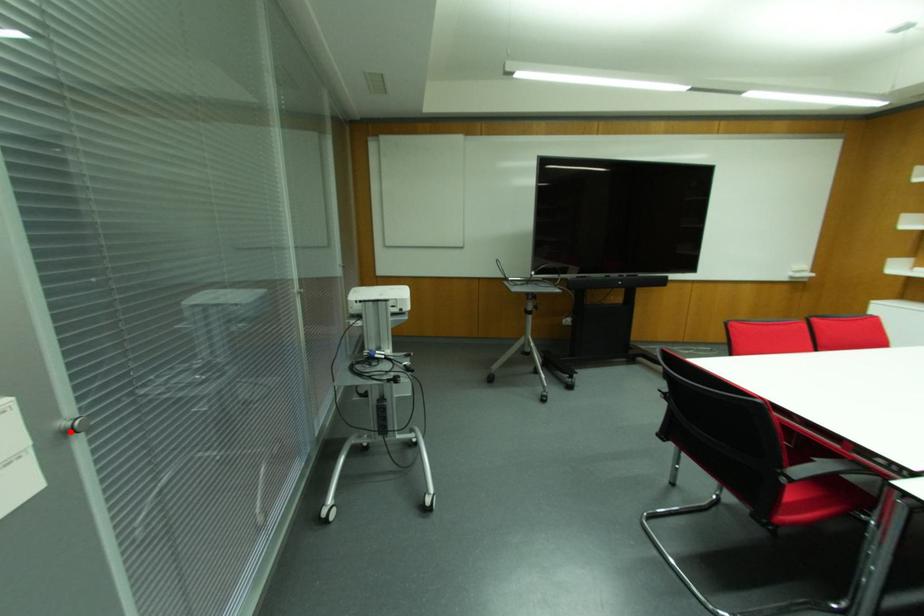
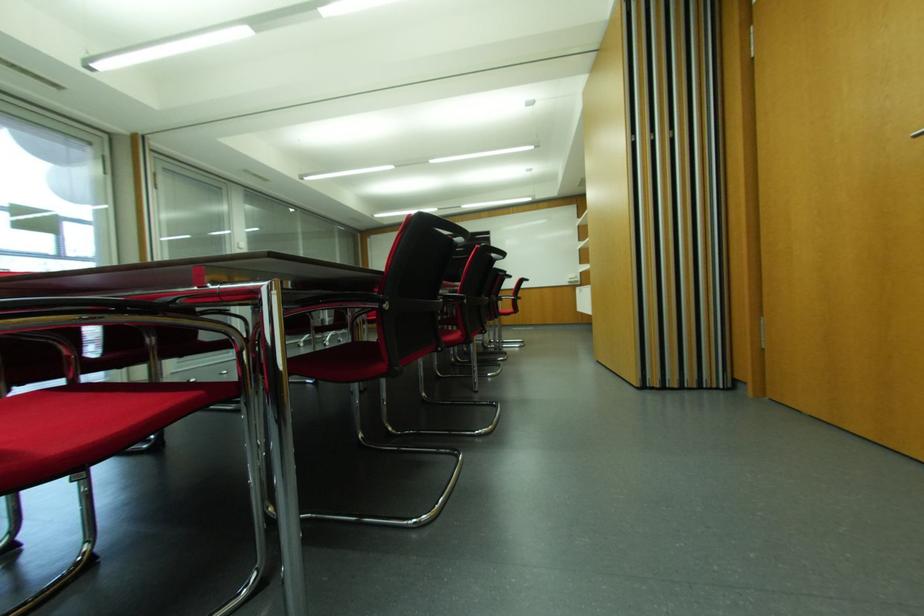
Question: I am providing you with two images of the same scene from different viewpoints. A red point is marked on the first image. Can you still see the location of the red point in image 2?

Choices:
 (A) Yes
 (B) No

Answer: (B)